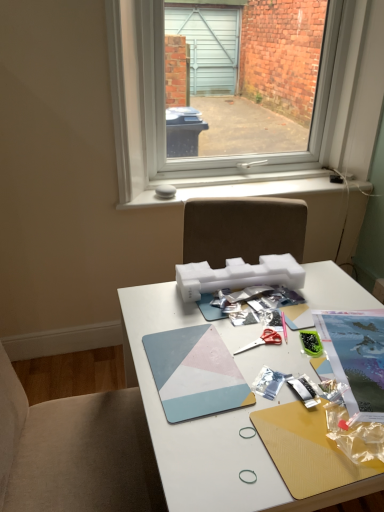
This screenshot has width=384, height=512. I want to click on vacant area that lies between red plastic scissors at center and green plastic container at center-right, so click(x=279, y=348).